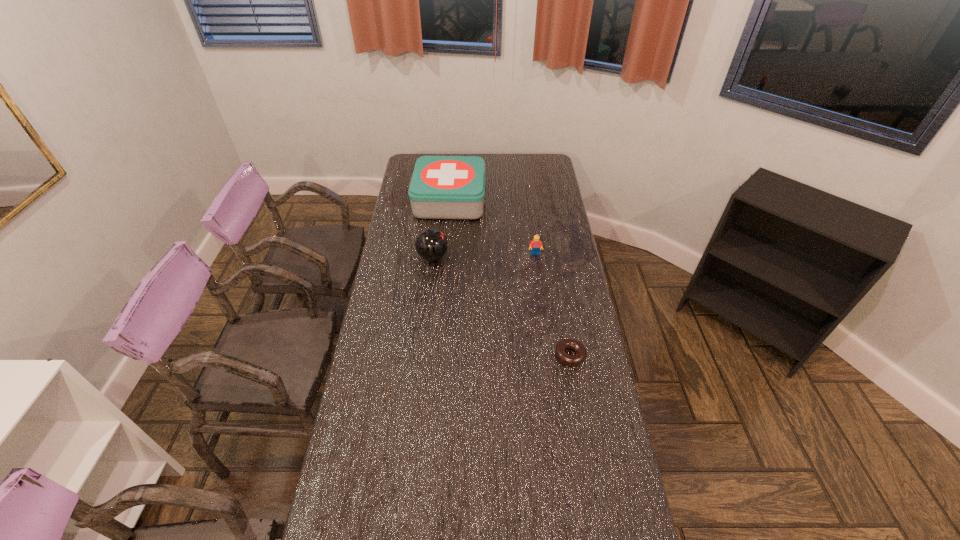
You are a GUI agent. You are given a task and a screenshot of the screen. Output one action in this format:
    pyautogui.click(x=<x>, y=<y>)
    Task: Click on the bowling ball situated at the left edge
    The height and width of the screenshot is (540, 960).
    Given the screenshot: What is the action you would take?
    pyautogui.click(x=431, y=244)

Where is `Lego at the right edge`? Image resolution: width=960 pixels, height=540 pixels. Lego at the right edge is located at coordinates (535, 244).

The width and height of the screenshot is (960, 540). I want to click on doughnut at the right edge, so click(571, 360).

You are a GUI agent. You are given a task and a screenshot of the screen. Output one action in this format:
    pyautogui.click(x=<x>, y=<y>)
    Task: Click on the free space at the far edge of the desktop
    The height and width of the screenshot is (540, 960).
    Given the screenshot: What is the action you would take?
    pyautogui.click(x=509, y=154)

Where is `free space at the left edge`? The width and height of the screenshot is (960, 540). free space at the left edge is located at coordinates (391, 257).

Image resolution: width=960 pixels, height=540 pixels. Identify the location of blank space at the right edge of the desktop. (x=562, y=306).

Where is `empty space between the farthest object and the bowling ball`? empty space between the farthest object and the bowling ball is located at coordinates (441, 228).

Where is `empty location between the bowling ball and the Lego`? empty location between the bowling ball and the Lego is located at coordinates (484, 255).

Identify the location of vacant point located between the bowling ball and the Lego. (484, 255).

Image resolution: width=960 pixels, height=540 pixels. I want to click on empty space between the third shortest object and the doughnut, so click(x=553, y=305).